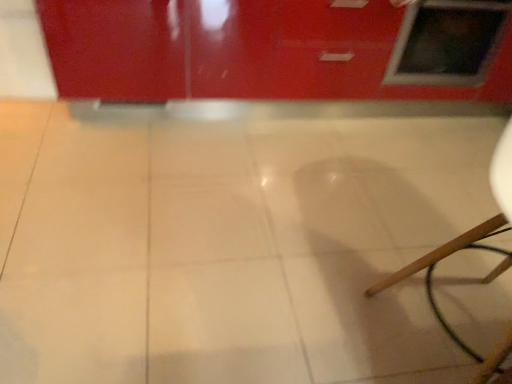
This screenshot has width=512, height=384. Identify the location of empty space that is ontop of white glossy tile at center (from a real-world perspective). (187, 228).